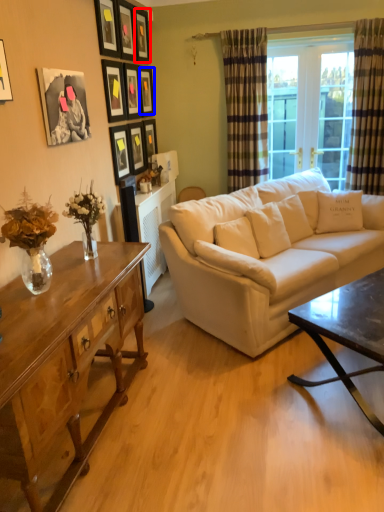
Question: Which object appears closest to the camera in this image, picture frame (highlighted by a red box) or picture frame (highlighted by a blue box)?

Choices:
 (A) picture frame
 (B) picture frame

Answer: (A)